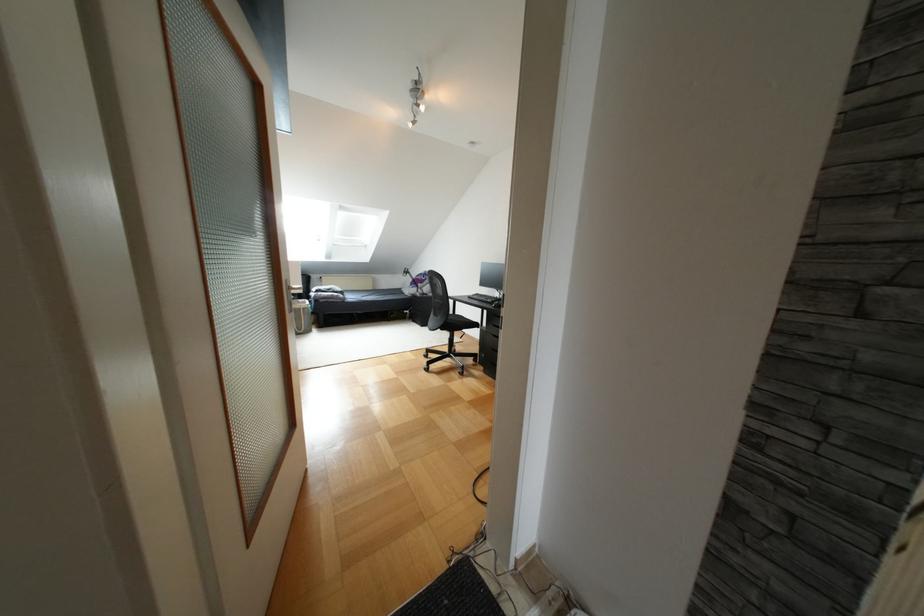
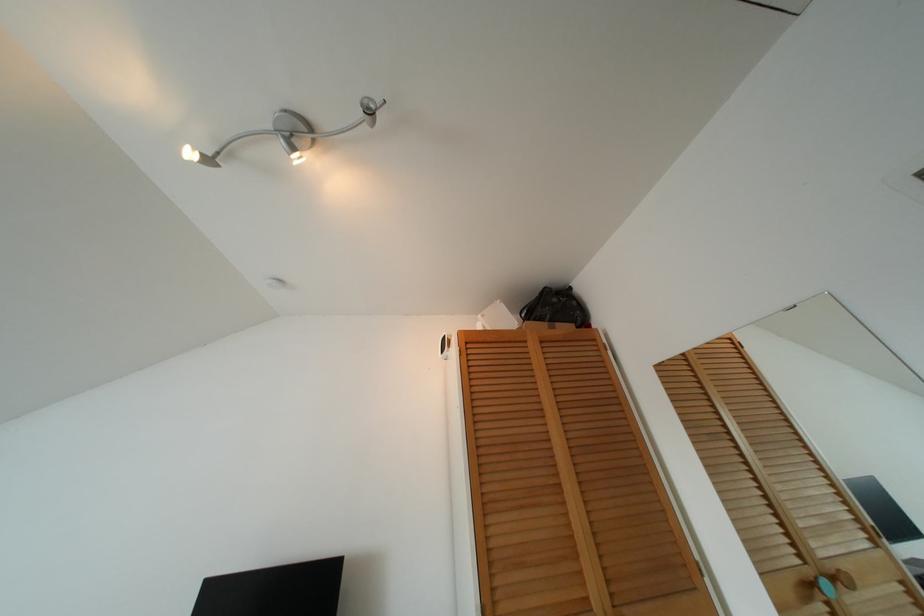
In the second image, find the point that corresponds to point 421,108 in the first image.

(297, 158)